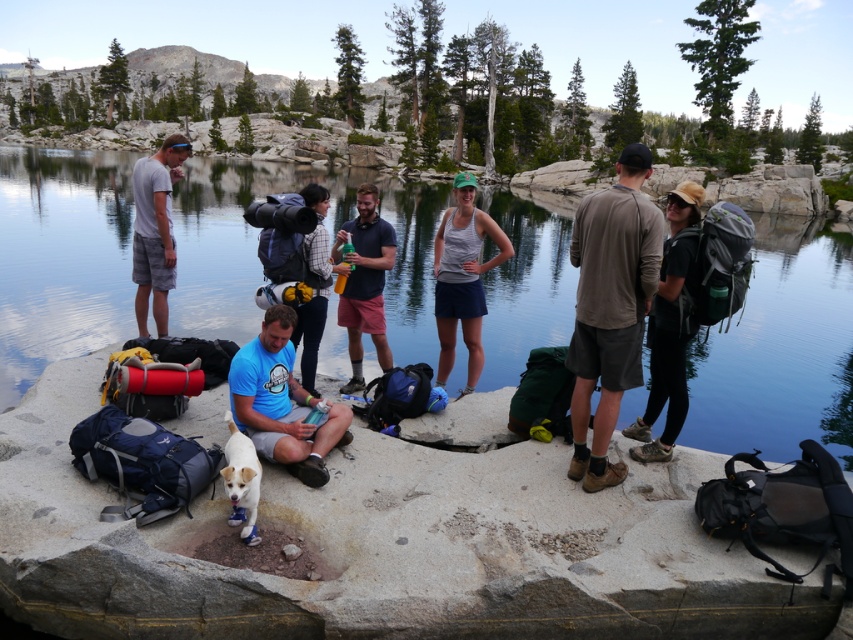
You are a photographer planning to take a group photo of the seven hikers at the lakeside. To ensure the gray rock at center is visible in the background, where should you position the camera relative to the group?

The gray rock at center is located at point (383, 547), so positioning the camera so that the group is framed in front of this coordinate will keep the gray rock at center visible in the background.